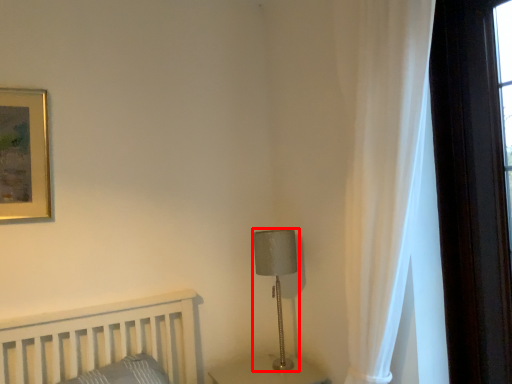
Question: Observing the image, what is the correct spatial positioning of table lamp (annotated by the red box) in reference to curtain?

Choices:
 (A) right
 (B) left

Answer: (B)